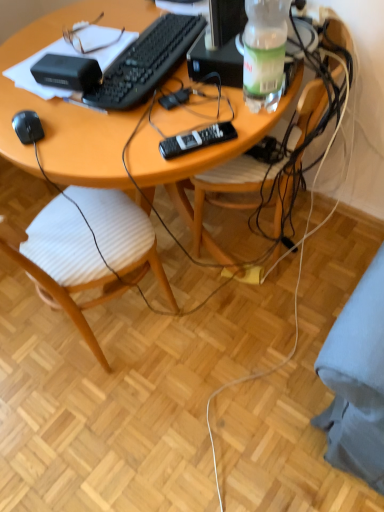
The image size is (384, 512). Identify the location of free spot behind black plastic remote at center. [x=192, y=106].